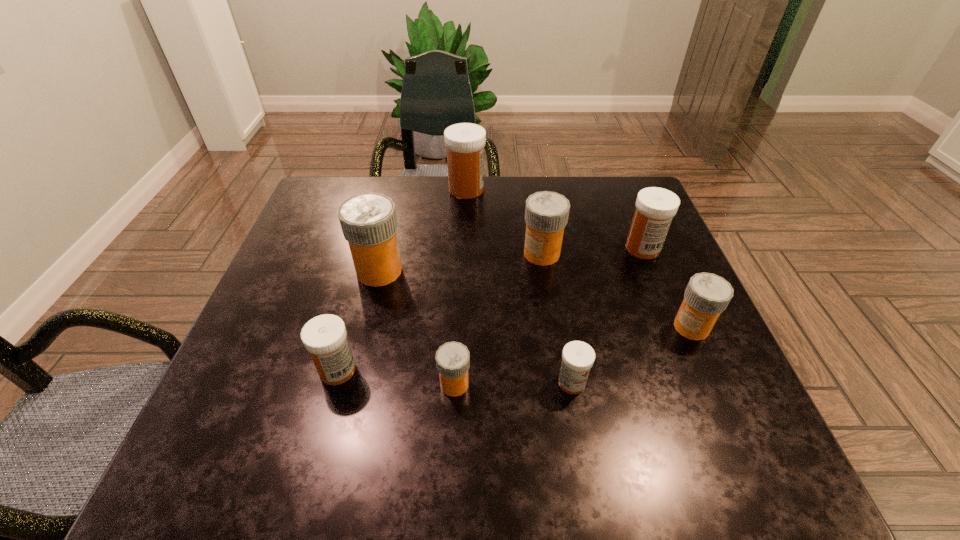
Where is `vacant area between the nearest orange medicine and the third biggest white medicine`? The width and height of the screenshot is (960, 540). vacant area between the nearest orange medicine and the third biggest white medicine is located at coordinates (396, 377).

Identify which object is the seventh closest to the smallest orange medicine. Please provide its 2D coordinates. Your answer should be formatted as a tuple, i.e. [(x, y)], where the tuple contains the x and y coordinates of a point satisfying the conditions above.

[(465, 142)]

Identify which object is the fourth nearest to the leftmost white medicine. Please provide its 2D coordinates. Your answer should be formatted as a tuple, i.e. [(x, y)], where the tuple contains the x and y coordinates of a point satisfying the conditions above.

[(546, 214)]

Image resolution: width=960 pixels, height=540 pixels. What are the coordinates of `the seventh closest medicine to the leftmost orange medicine` in the screenshot? It's located at (707, 295).

Where is `medicine that stands as the fourth closest to the leftmost orange medicine`? The height and width of the screenshot is (540, 960). medicine that stands as the fourth closest to the leftmost orange medicine is located at coordinates (546, 214).

This screenshot has width=960, height=540. What are the coordinates of `the second closest white medicine to the second orange medicine from right to left` in the screenshot? It's located at (465, 142).

This screenshot has width=960, height=540. I want to click on white medicine object that ranks as the fourth closest to the nearest orange medicine, so click(465, 142).

The height and width of the screenshot is (540, 960). I want to click on orange medicine that is the third closest one to the rightmost white medicine, so click(452, 359).

Identify which orange medicine is the fourth closest to the third biggest white medicine. Please provide its 2D coordinates. Your answer should be formatted as a tuple, i.e. [(x, y)], where the tuple contains the x and y coordinates of a point satisfying the conditions above.

[(707, 295)]

At what (x,y) coordinates should I click in order to perform the action: click on vacant space that satisfies the following two spatial constraints: 1. on the front side of the smallest white medicine; 2. on the right side of the farthest white medicine. Please return your answer as a coordinate pair (x, y). Image resolution: width=960 pixels, height=540 pixels. Looking at the image, I should click on point(459,382).